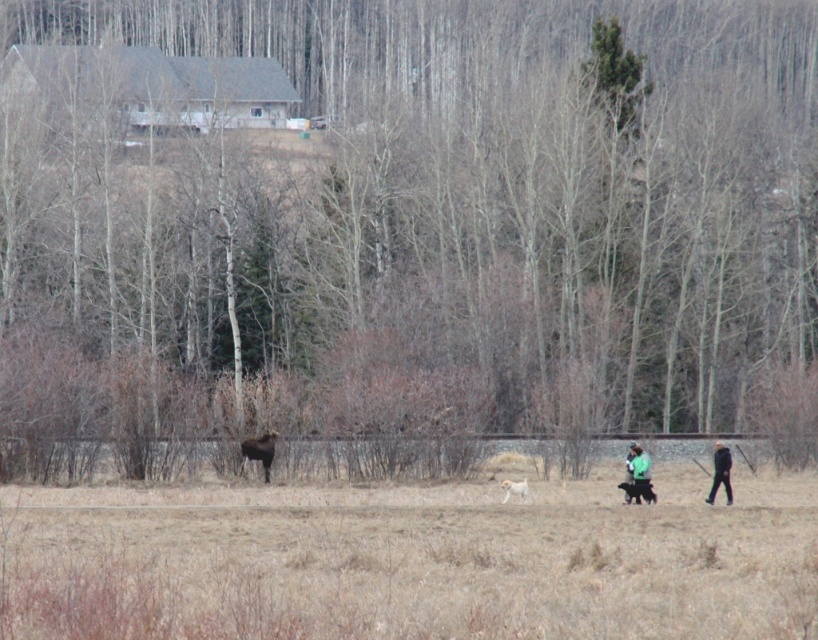
You are a hiker in the field. You see a moose near the edge of the field and a point marked at coordinates (x=639, y=476). What object is located at that point?

The point at coordinates (x=639, y=476) indicates the green fabric jacket at lower right.